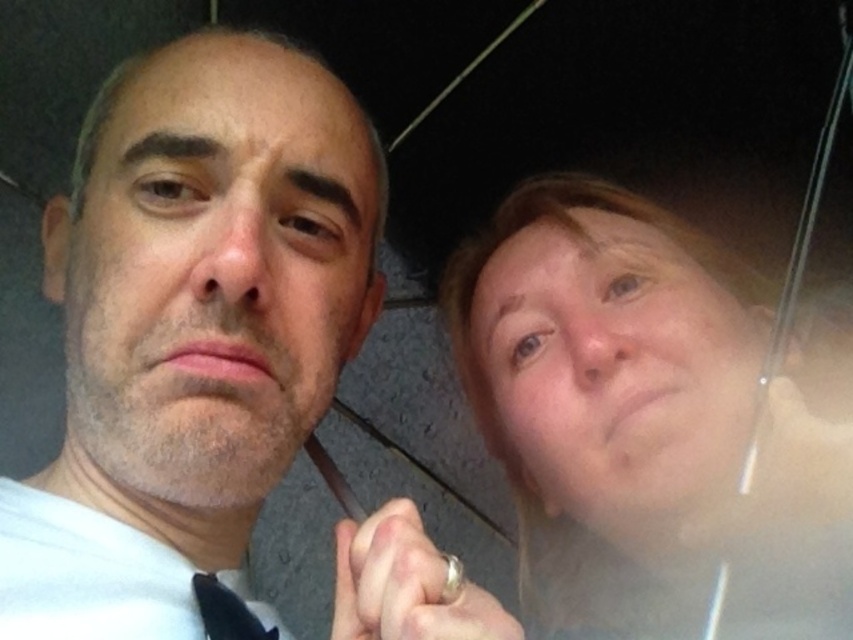
Question: Estimate the real-world distances between objects in this image. Which object is farther from the smooth skin face at center?

Choices:
 (A) smooth skin face at right
 (B) matte white shirt at left
 (C) translucent plastic umbrella at upper right
 (D) black silk tie at lower left

Answer: (C)

Question: Which point is closer to the camera?

Choices:
 (A) (190, 333)
 (B) (225, 612)
 (C) (666, 225)

Answer: (A)

Question: Among these points, which one is farthest from the camera?

Choices:
 (A) (200, 196)
 (B) (245, 634)
 (C) (67, 456)
 (D) (670, 348)

Answer: (D)

Question: From the image, what is the correct spatial relationship of smooth skin face at right in relation to black silk tie at lower left?

Choices:
 (A) above
 (B) below

Answer: (A)

Question: Is the position of matte white shirt at left more distant than that of smooth skin face at right?

Choices:
 (A) no
 (B) yes

Answer: (A)

Question: From the image, what is the correct spatial relationship of matte white shirt at left in relation to translucent plastic umbrella at upper right?

Choices:
 (A) below
 (B) above

Answer: (B)